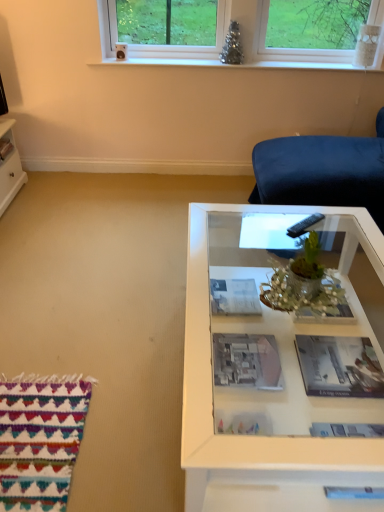
Question: Which direction should I rotate to look at matte paper magazine at center, the second magazine from the bottom?

Choices:
 (A) left
 (B) right

Answer: (B)

Question: Is there a large distance between matte gray book at center, positioned as the first book in right-to-left order, and black plastic remote at center?

Choices:
 (A) no
 (B) yes

Answer: (A)

Question: Is black plastic remote at center completely or partially inside matte gray book at center, marked as the 1th book in a front-to-back arrangement?

Choices:
 (A) yes
 (B) no

Answer: (B)

Question: From a real-world perspective, is matte gray book at center, positioned as the first book in right-to-left order, located beneath black plastic remote at center?

Choices:
 (A) no
 (B) yes

Answer: (B)

Question: From the image's perspective, is matte gray book at center, which is counted as the 2th book, starting from the back, located beneath black plastic remote at center?

Choices:
 (A) yes
 (B) no

Answer: (A)

Question: Is matte gray book at center, positioned as the first book in right-to-left order, taller than black plastic remote at center?

Choices:
 (A) yes
 (B) no

Answer: (B)

Question: Could you tell me if matte gray book at center, the second book positioned from the top, is facing black plastic remote at center?

Choices:
 (A) no
 (B) yes

Answer: (A)

Question: Can you see matte gray book at center, which is counted as the 2th book, starting from the back, touching matte black book at lower left, which ranks as the first book in back-to-front order?

Choices:
 (A) no
 (B) yes

Answer: (A)

Question: Is matte gray book at center, which is counted as the 1th book, starting from the bottom, positioned beyond the bounds of matte black book at lower left, which ranks as the first book in back-to-front order?

Choices:
 (A) no
 (B) yes

Answer: (B)

Question: From the image's perspective, is matte gray book at center, which appears as the second book when viewed from the left, beneath matte black book at lower left, which ranks as the first book in back-to-front order?

Choices:
 (A) no
 (B) yes

Answer: (B)

Question: Is matte gray book at center, which is counted as the 2th book, starting from the back, further to the viewer compared to matte black book at lower left, which ranks as the first book in back-to-front order?

Choices:
 (A) yes
 (B) no

Answer: (B)

Question: Is matte gray book at center, the second book positioned from the top, wider than matte black book at lower left, which ranks as the first book in back-to-front order?

Choices:
 (A) no
 (B) yes

Answer: (B)

Question: From a real-world perspective, is matte gray book at center, marked as the 1th book in a front-to-back arrangement, below matte black book at lower left, which is counted as the second book, starting from the right?

Choices:
 (A) no
 (B) yes

Answer: (B)

Question: Does white glass table at center have a greater width compared to black plastic remote at center?

Choices:
 (A) yes
 (B) no

Answer: (A)